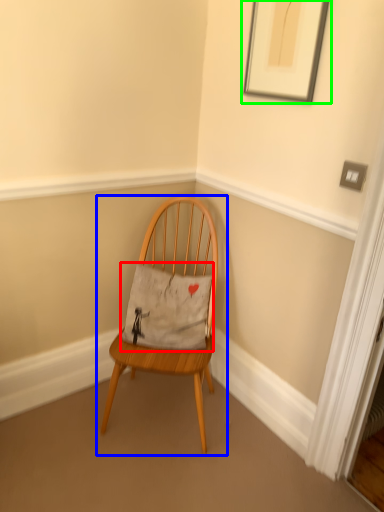
Question: Based on their relative distances, which object is nearer to pillow (highlighted by a red box)? Choose from chair (highlighted by a blue box) and picture frame (highlighted by a green box).

Choices:
 (A) chair
 (B) picture frame

Answer: (A)